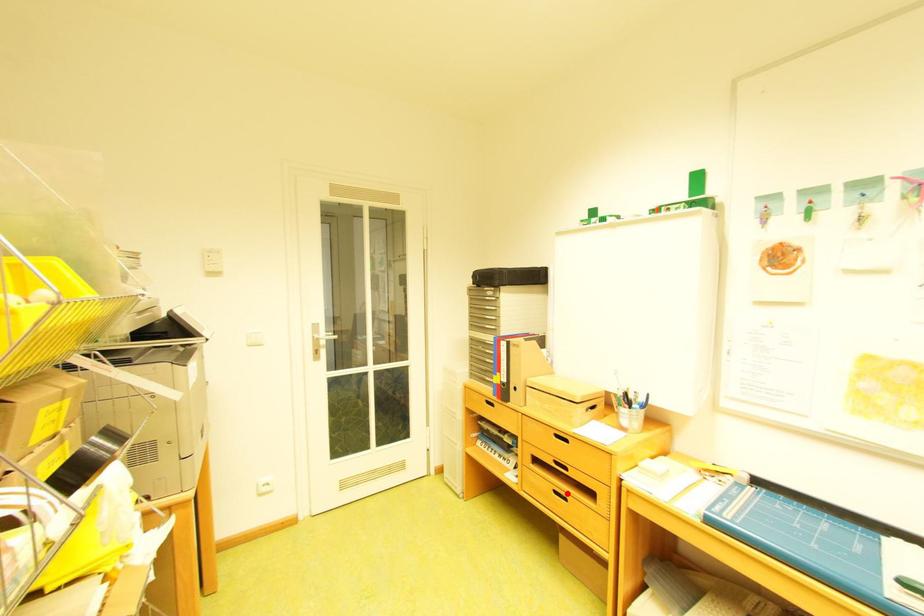
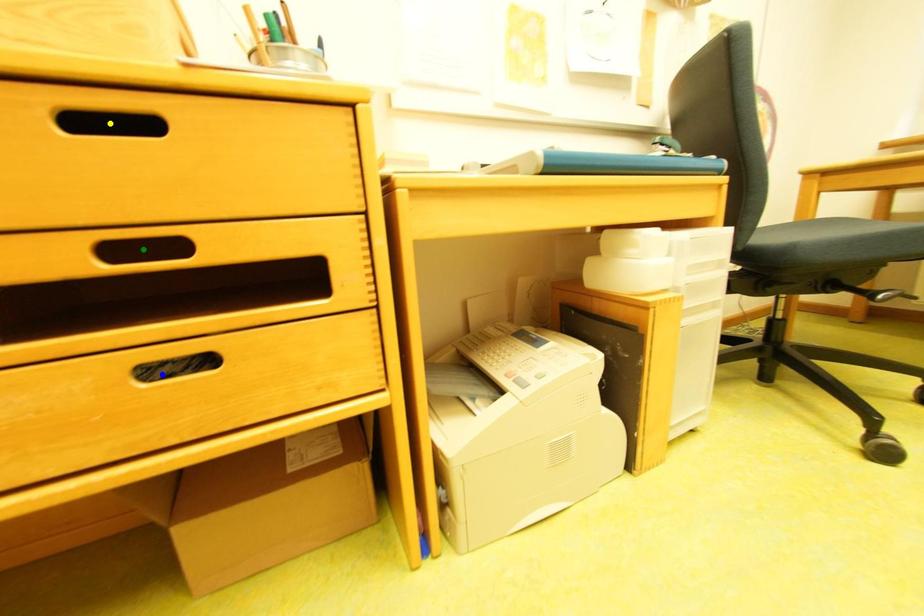
Question: I am providing you with two images of the same scene from different viewpoints. A red point is marked on the first image. You are given multiple points on the second image. In image 2, which mark is for the same physical point as the one in image 1?

Choices:
 (A) yellow point
 (B) blue point
 (C) green point

Answer: (B)